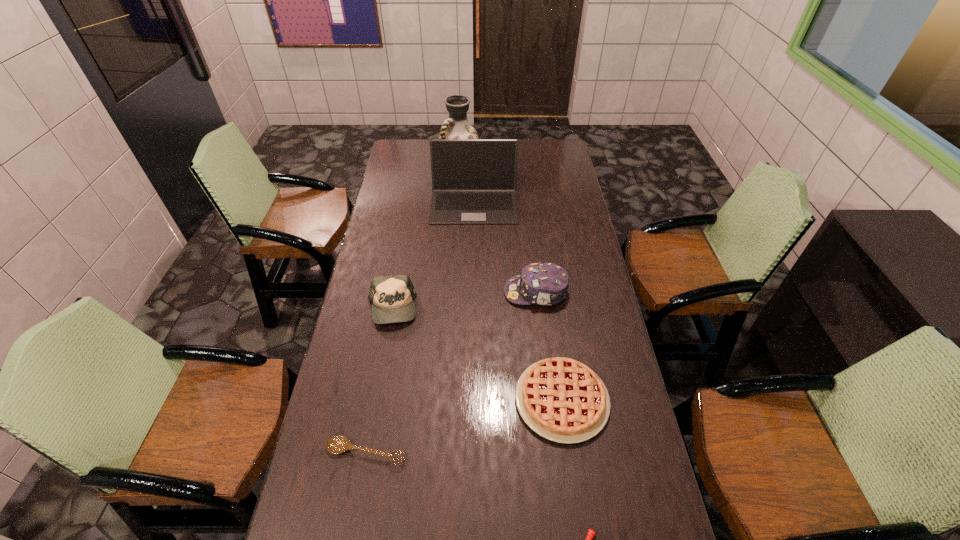
At what (x,y) coordinates should I click in order to perform the action: click on pie situated at the right edge. Please return your answer as a coordinate pair (x, y). Looking at the image, I should click on (561, 399).

I want to click on free space at the far edge, so click(x=533, y=162).

Locate an element on the screen. The height and width of the screenshot is (540, 960). free space at the left edge is located at coordinates (347, 489).

In the image, there is a desktop. At what (x,y) coordinates should I click in order to perform the action: click on free region at the right edge. Please return your answer as a coordinate pair (x, y). Image resolution: width=960 pixels, height=540 pixels. Looking at the image, I should click on (547, 232).

What are the coordinates of `free space at the far left corner of the desktop` in the screenshot? It's located at (423, 140).

You are a GUI agent. You are given a task and a screenshot of the screen. Output one action in this format:
    pyautogui.click(x=<x>, y=<y>)
    Task: Click on the vacant area that lies between the ladle and the headwear
    This screenshot has width=960, height=540.
    Given the screenshot: What is the action you would take?
    pyautogui.click(x=451, y=373)

Find the location of a particular element. This screenshot has width=960, height=540. vacant space that's between the second farthest object and the headwear is located at coordinates (505, 248).

This screenshot has width=960, height=540. I want to click on vacant area that lies between the headwear and the ladle, so click(x=451, y=373).

Where is `vacant area that lies between the second shortest object and the headwear`? vacant area that lies between the second shortest object and the headwear is located at coordinates (451, 373).

The image size is (960, 540). In order to click on object that ranks as the fifth closest to the ladle in this screenshot , I will do `click(473, 180)`.